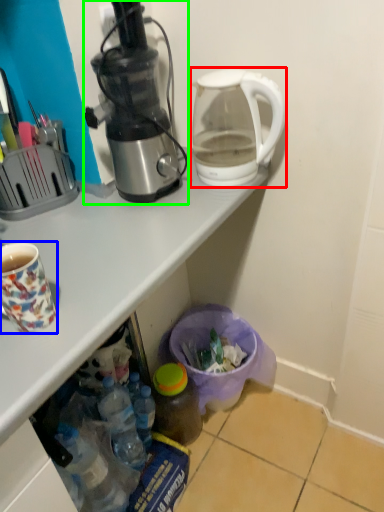
Question: Considering the real-world distances, which object is farthest from kettle (highlighted by a red box)? coffee cup (highlighted by a blue box) or coffee maker (highlighted by a green box)?

Choices:
 (A) coffee cup
 (B) coffee maker

Answer: (A)